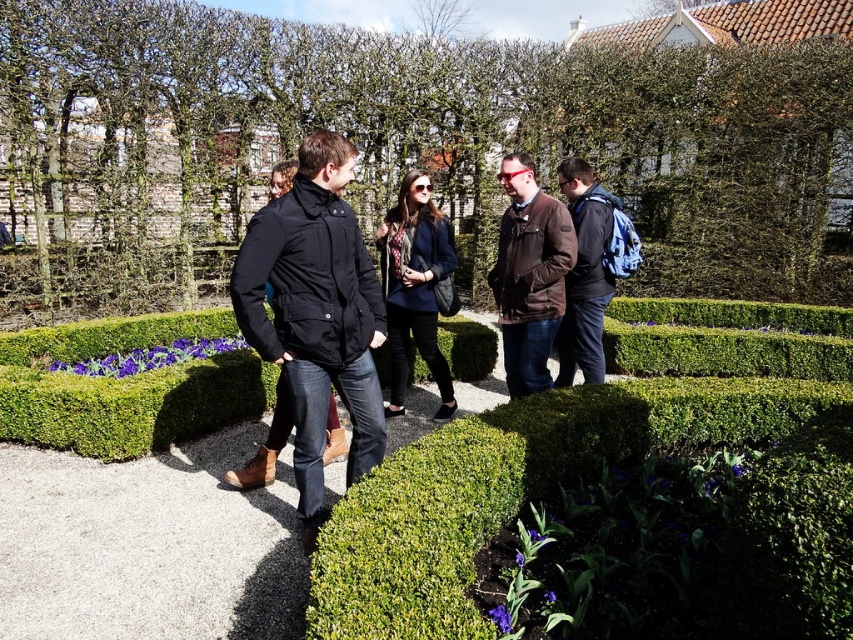
You are standing in the garden and see the point at coordinates (529, 275). Which object is this point located on?

The point at coordinates (529, 275) is located on the brown leather jacket at center.

You are standing at the origin point in the garden. The green leafy hedge at center is located at coordinates 0.228, 0.469. If you want to walk directly towards it, which direction should you head?

The green leafy hedge at center is located at coordinates (399, 145). Since the x and y coordinates are both positive, you should head northeast to reach it.

You are a hiker who needs to retrieve your blue backpack at center. You are currently standing behind the green leafy hedge at center. Can you directly reach your backpack without moving the hedge?

The green leafy hedge at center is positioned over the blue backpack at center, so the hedge is blocking the backpack. You need to move the hedge to access the backpack.